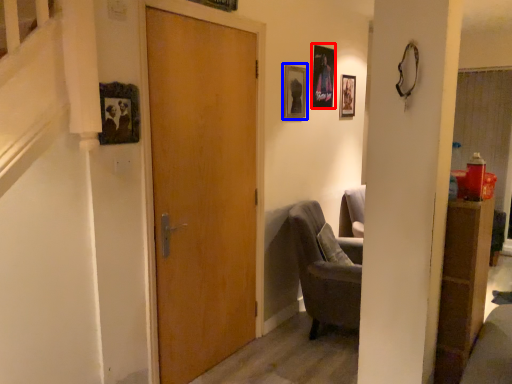
Question: Among these objects, which one is farthest to the camera, picture frame (highlighted by a red box) or picture frame (highlighted by a blue box)?

Choices:
 (A) picture frame
 (B) picture frame

Answer: (A)